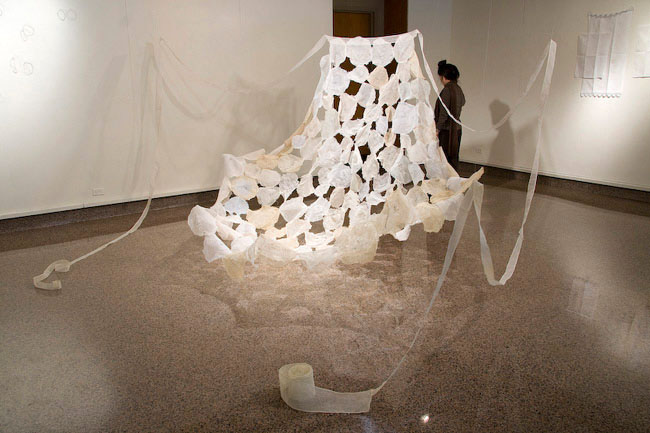
At what (x,y) coordinates should I click in order to perform the action: click on wallpaper. Please return your answer as a coordinate pair (x, y). This screenshot has width=650, height=433. Looking at the image, I should click on (610, 41).